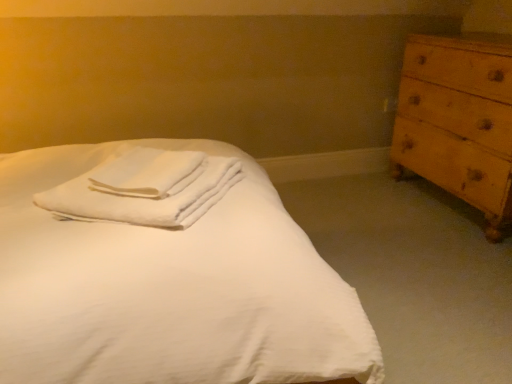
Where is `vacant area that is in front of wooden chest of drawers at right`? This screenshot has width=512, height=384. vacant area that is in front of wooden chest of drawers at right is located at coordinates (442, 267).